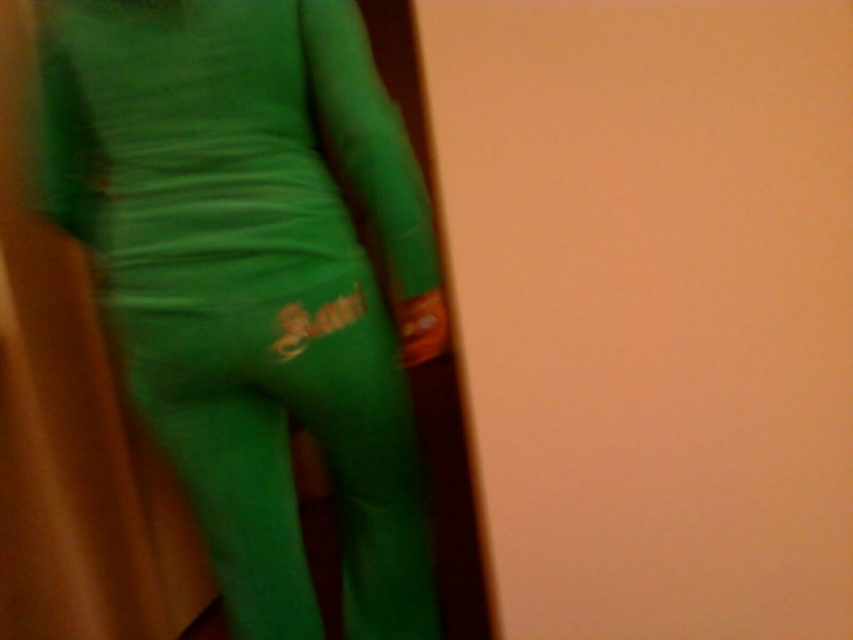
You are a tailor who needs to adjust the green matte leggings at center to fit a client. The client mentioned they want the leggings to be closer to the wooden structure on the left. How much distance should you reduce between the leggings and the wooden structure?

The current distance between the green matte leggings at center and the wooden structure on the left is 98.56 centimeters. To meet the client request, the tailor should reduce the distance by 98.56 centimeters so that the leggings are positioned right next to the wooden structure.

You are an interior designer working on a project. You need to place a small decorative item at point (254, 278) in the image. What object will be at that point?

At point (254, 278) lies green matte leggings at center.

You are a fashion designer trying to create a cohesive outfit. You have two green items in the image, the green matte leggings at center and the matte green pants at center. Which one is longer in height?

The green matte leggings at center is taller than the matte green pants at center.